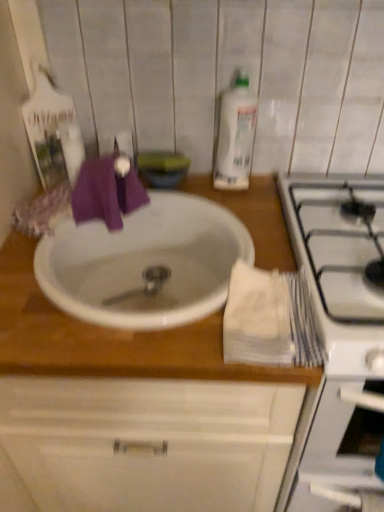
In order to face white glossy sink at center, should I rotate leftwards or rightwards?

Turn left by 5.283 degrees to look at white glossy sink at center.

Describe the element at coordinates (132, 411) in the screenshot. The width and height of the screenshot is (384, 512). I see `white matte sink at center` at that location.

What are the coordinates of `clear plastic bottle at upper center` in the screenshot? It's located at (235, 135).

Looking at this image, from the image's perspective, is white glossy stove at right on top of clear plastic bottle at upper center?

No.

Does white glossy stove at right have a lesser height compared to clear plastic bottle at upper center?

No, white glossy stove at right is not shorter than clear plastic bottle at upper center.

Which of these two, white glossy stove at right or clear plastic bottle at upper center, is bigger?

white glossy stove at right.

Locate an element on the screen. The width and height of the screenshot is (384, 512). appliance in front of the clear plastic bottle at upper center is located at coordinates (339, 342).

I want to click on countertop on the left of the clear plastic bottle at upper center, so click(x=132, y=411).

Which of these two, white matte sink at center or clear plastic bottle at upper center, is thinner?

With smaller width is clear plastic bottle at upper center.

Could you tell me if white matte sink at center is facing clear plastic bottle at upper center?

No, white matte sink at center is not aimed at clear plastic bottle at upper center.

Is white matte sink at center not close to clear plastic bottle at upper center?

No, white matte sink at center is not far away from clear plastic bottle at upper center.

Is clear plastic bottle at upper center to the right of white glossy sink at center from the viewer's perspective?

Yes.

From a real-world perspective, is clear plastic bottle at upper center physically below white glossy sink at center?

No, from a real-world perspective, clear plastic bottle at upper center is not below white glossy sink at center.

Is the depth of clear plastic bottle at upper center less than that of white glossy sink at center?

No, clear plastic bottle at upper center is further to the viewer.

Are clear plastic bottle at upper center and white glossy sink at center far apart?

clear plastic bottle at upper center is near white glossy sink at center, not far away.

Is white matte sink at center oriented towards white glossy stove at right?

No, white matte sink at center is not aimed at white glossy stove at right.

Between white matte sink at center and white glossy stove at right, which one has less height?

Standing shorter between the two is white glossy stove at right.

Is white matte sink at center not near white glossy stove at right?

No, white matte sink at center is not far away from white glossy stove at right.

How different are the orientations of white matte sink at center and white glossy stove at right in degrees?

The angular difference between white matte sink at center and white glossy stove at right is 5.53e-05 degrees.

At what (x,y) coordinates should I click in order to perform the action: click on countertop in front of the white glossy sink at center. Please return your answer as a coordinate pair (x, y). Looking at the image, I should click on (132, 411).

From a real-world perspective, is white glossy sink at center on white matte sink at center?

Indeed, from a real-world perspective, white glossy sink at center stands above white matte sink at center.

Would you consider white glossy sink at center to be distant from white matte sink at center?

No, white glossy sink at center is not far away from white matte sink at center.

Does white glossy sink at center have a smaller size compared to white matte sink at center?

Correct, white glossy sink at center occupies less space than white matte sink at center.

Which is behind, point (376, 418) or point (165, 404)?

Positioned behind is point (165, 404).

Who is more distant, white glossy stove at right or white matte sink at center?

white matte sink at center is further away from the camera.

Where is `countertop above the white glossy stove at right (from the image's perspective)`? The image size is (384, 512). countertop above the white glossy stove at right (from the image's perspective) is located at coordinates (132, 411).

Measure the distance between white glossy stove at right and white matte sink at center.

They are 8.62 inches apart.

Is white glossy sink at center aimed at white glossy stove at right?

No, white glossy sink at center is not turned towards white glossy stove at right.

Is white glossy stove at right surrounded by white glossy sink at center?

No.

Would you say white glossy sink at center is a long distance from white glossy stove at right?

white glossy sink at center is near white glossy stove at right, not far away.

Is point (52, 292) positioned before point (341, 225)?

Yes, point (52, 292) is closer to viewer.

Identify the location of appliance below the clear plastic bottle at upper center (from the image's perspective). (339, 342).

You are a GUI agent. You are given a task and a screenshot of the screen. Output one action in this format:
    pyautogui.click(x=<x>, y=<y>)
    Task: Click on the countertop in front of the clear plastic bottle at upper center
    The height and width of the screenshot is (512, 384).
    Given the screenshot: What is the action you would take?
    pyautogui.click(x=132, y=411)

Looking at this image, considering their positions, is white glossy sink at center positioned closer to white matte sink at center than clear plastic bottle at upper center?

white glossy sink at center.

Considering their positions, is clear plastic bottle at upper center positioned further to white matte sink at center than white glossy sink at center?

clear plastic bottle at upper center is positioned further to the anchor white matte sink at center.

Considering their positions, is white glossy sink at center positioned further to white glossy stove at right than white matte sink at center?

The object further to white glossy stove at right is white glossy sink at center.

From the image, which object appears to be nearer to white glossy sink at center, white matte sink at center or white glossy stove at right?

white matte sink at center.

Based on their spatial positions, is white glossy stove at right or white glossy sink at center further from clear plastic bottle at upper center?

white glossy stove at right.

Considering their positions, is white glossy sink at center positioned further to white glossy stove at right than clear plastic bottle at upper center?

clear plastic bottle at upper center is positioned further to the anchor white glossy stove at right.

Which object lies further to the anchor point white matte sink at center, white glossy stove at right or white glossy sink at center?

Based on the image, white glossy stove at right appears to be further to white matte sink at center.

Looking at the image, which one is located further to white glossy stove at right, clear plastic bottle at upper center or white matte sink at center?

clear plastic bottle at upper center lies further to white glossy stove at right than the other object.

Identify the location of sink between clear plastic bottle at upper center and white glossy stove at right vertically. The image size is (384, 512). (145, 263).

You are a GUI agent. You are given a task and a screenshot of the screen. Output one action in this format:
    pyautogui.click(x=<x>, y=<y>)
    Task: Click on the sink between clear plastic bottle at upper center and white matte sink at center vertically
    
    Given the screenshot: What is the action you would take?
    pyautogui.click(x=145, y=263)

I want to click on countertop between clear plastic bottle at upper center and white glossy stove at right vertically, so click(132, 411).

Where is `sink between white matte sink at center and white glossy stove at right`? This screenshot has height=512, width=384. sink between white matte sink at center and white glossy stove at right is located at coordinates (145, 263).